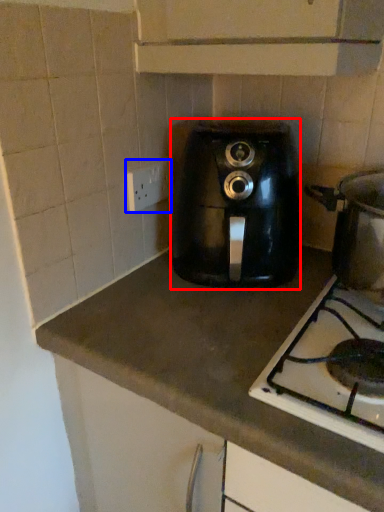
Question: Among these objects, which one is farthest to the camera, home appliance (highlighted by a red box) or electric outlet (highlighted by a blue box)?

Choices:
 (A) home appliance
 (B) electric outlet

Answer: (B)